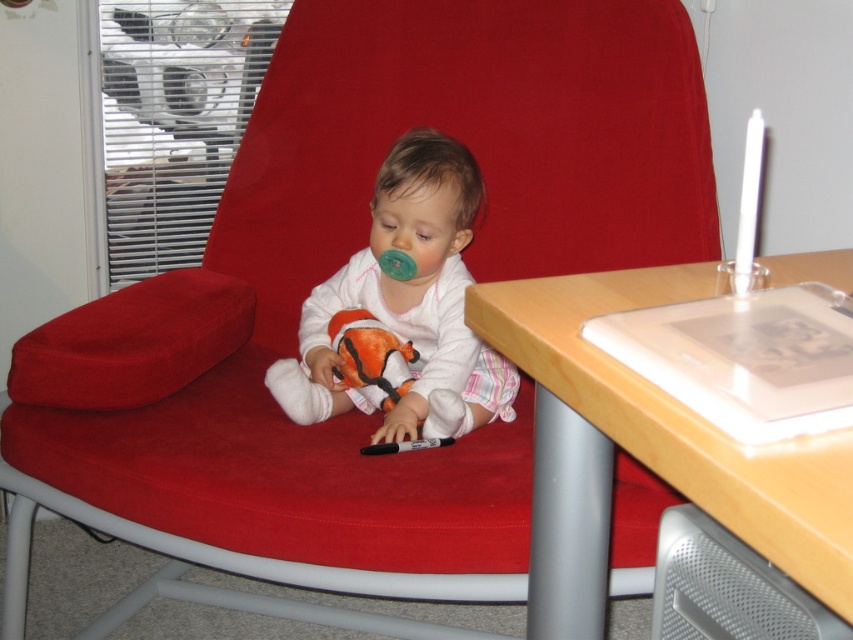
You are a parent trying to place a toy on the wooden table at lower right so your child can reach it easily. The white soft baby at center is currently in the way. Which object should you move to make space?

You should move the white soft baby at center because the wooden table at lower right is located below it, so moving the white soft baby at center will free up space on the table.

You are a parent trying to place a toy on the wooden table at lower right so your child can reach it easily. Based on the scene, where should you place the toy relative to the white soft baby at center?

The wooden table at lower right is positioned on the right side of the white soft baby at center, so placing the toy on the wooden table at lower right would place it to the right of the white soft baby at center, making it easily reachable for the child.